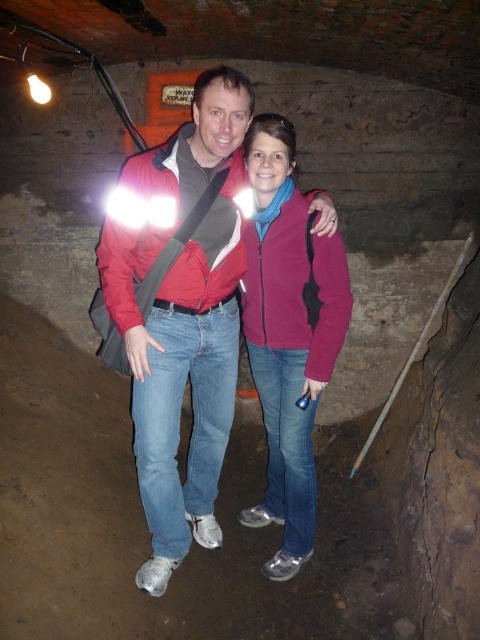
Question: Among these objects, which one is nearest to the camera?

Choices:
 (A) matte red jacket at center
 (B) matte pink jacket at center

Answer: (A)

Question: Considering the relative positions of matte red jacket at center and matte pink jacket at center in the image provided, where is matte red jacket at center located with respect to matte pink jacket at center?

Choices:
 (A) below
 (B) above

Answer: (B)

Question: Is the position of matte red jacket at center less distant than that of matte pink jacket at center?

Choices:
 (A) no
 (B) yes

Answer: (B)

Question: Is matte red jacket at center smaller than matte pink jacket at center?

Choices:
 (A) no
 (B) yes

Answer: (A)

Question: Which object appears closest to the camera in this image?

Choices:
 (A) matte pink jacket at center
 (B) matte red jacket at center

Answer: (B)

Question: Which of the following is the closest to the observer?

Choices:
 (A) matte red jacket at center
 (B) matte pink jacket at center

Answer: (A)